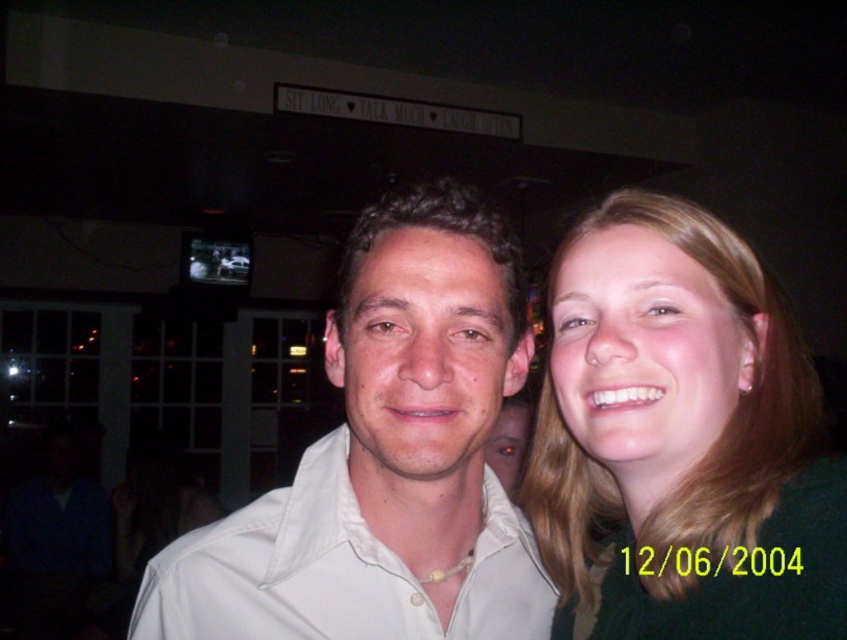
Is blonde hair at center further to camera compared to white matte shirt at center?

That is False.

Is blonde hair at center above white matte shirt at center?

No, blonde hair at center is not above white matte shirt at center.

Is point (740, 342) behind point (473, 444)?

Yes, it is.

Image resolution: width=847 pixels, height=640 pixels. In order to click on blonde hair at center in this screenshot , I will do click(679, 440).

Who is positioned more to the left, white matte shirt at center or white satin shirt at center?

white satin shirt at center is more to the left.

Does white matte shirt at center have a lesser height compared to white satin shirt at center?

No, white matte shirt at center is not shorter than white satin shirt at center.

Find the location of a particular element. This screenshot has height=640, width=847. white matte shirt at center is located at coordinates (385, 460).

Image resolution: width=847 pixels, height=640 pixels. What do you see at coordinates (679, 440) in the screenshot?
I see `blonde hair at center` at bounding box center [679, 440].

Between blonde hair at center and white satin shirt at center, which one has more height?

blonde hair at center is taller.

Is point (630, 577) positioned before point (266, 513)?

Yes.

Locate an element on the screen. The image size is (847, 640). blonde hair at center is located at coordinates (679, 440).